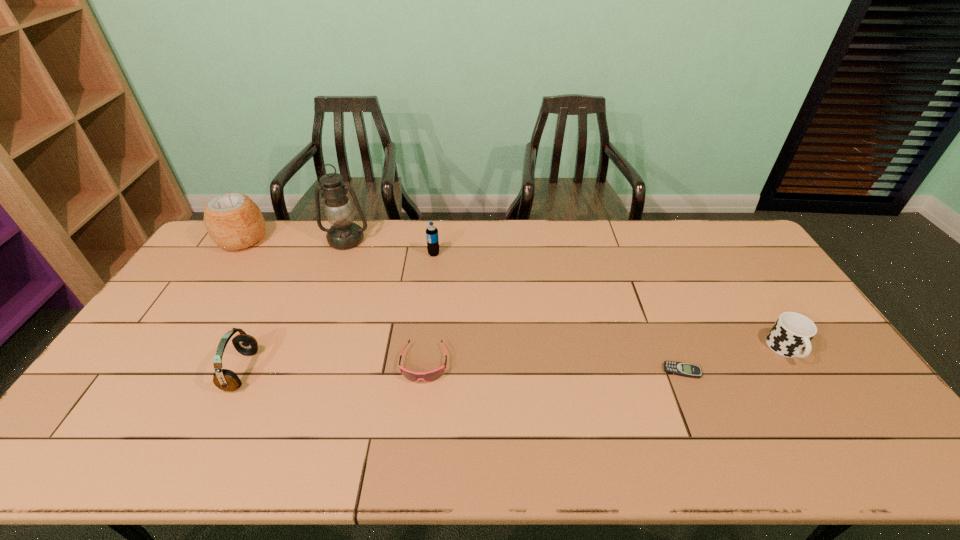
Locate an element on the screen. free space between the goggles and the headset is located at coordinates (333, 367).

Find the location of a particular element. Image resolution: width=960 pixels, height=540 pixels. unoccupied area between the second shortest object and the second object from right to left is located at coordinates (553, 367).

Locate an element on the screen. The image size is (960, 540). vacant space in between the sixth object from right to left and the soda bottle is located at coordinates (338, 312).

The width and height of the screenshot is (960, 540). What are the coordinates of `vacant point located between the third object from left to right and the second tallest object` in the screenshot? It's located at (295, 240).

What are the coordinates of `unoccupied area between the rightmost object and the shortest object` in the screenshot? It's located at (733, 360).

Identify the location of free space between the rightmost object and the fifth object from right to left. (566, 295).

This screenshot has width=960, height=540. What are the coordinates of `empty space between the cup and the oil lamp` in the screenshot? It's located at (566, 295).

Where is `vacant point located between the second tallest object and the tallest object`? This screenshot has width=960, height=540. vacant point located between the second tallest object and the tallest object is located at coordinates (295, 240).

The image size is (960, 540). In order to click on object that is the fifth closest to the beeper in this screenshot , I will do coord(225,379).

Locate an element on the screen. object that is the sixth closest to the sixth shortest object is located at coordinates coord(791,334).